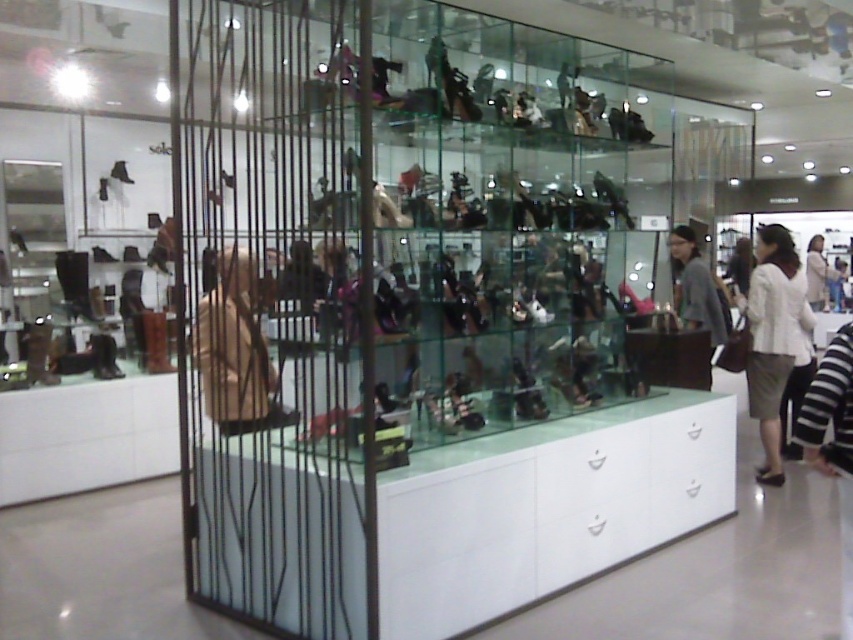
This screenshot has height=640, width=853. Describe the element at coordinates (773, 337) in the screenshot. I see `white fabric skirt at lower right` at that location.

Who is positioned more to the right, white fabric skirt at lower right or gray fabric jacket at center?

white fabric skirt at lower right

Locate an element on the screen. white fabric skirt at lower right is located at coordinates (773, 337).

Identify the location of white fabric skirt at lower right. This screenshot has width=853, height=640. click(773, 337).